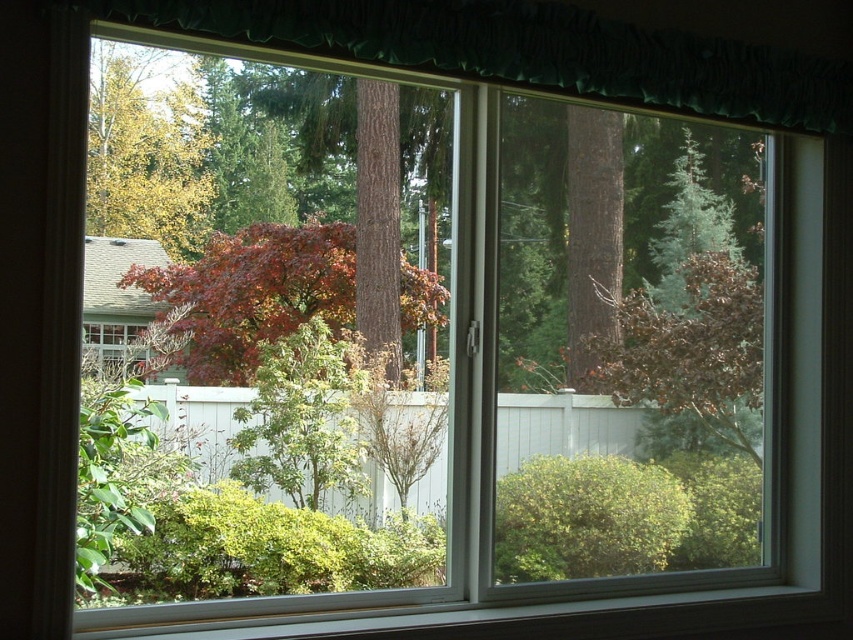
Can you confirm if green textured curtain at upper center is smaller than green matte tree at upper left?

No, green textured curtain at upper center is not smaller than green matte tree at upper left.

Does green textured curtain at upper center have a larger size compared to green matte tree at upper left?

Yes, green textured curtain at upper center is bigger than green matte tree at upper left.

Which is in front, point (280, 28) or point (91, 193)?

Point (280, 28) is more forward.

I want to click on green textured curtain at upper center, so click(x=531, y=51).